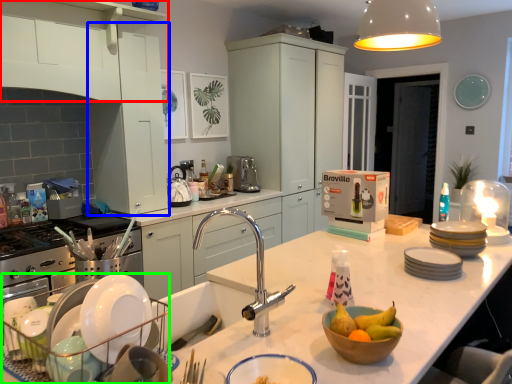
Question: Which is nearer to the cabinetry (highlighted by a red box)? cabinetry (highlighted by a blue box) or appliance (highlighted by a green box).

Choices:
 (A) cabinetry
 (B) appliance

Answer: (A)